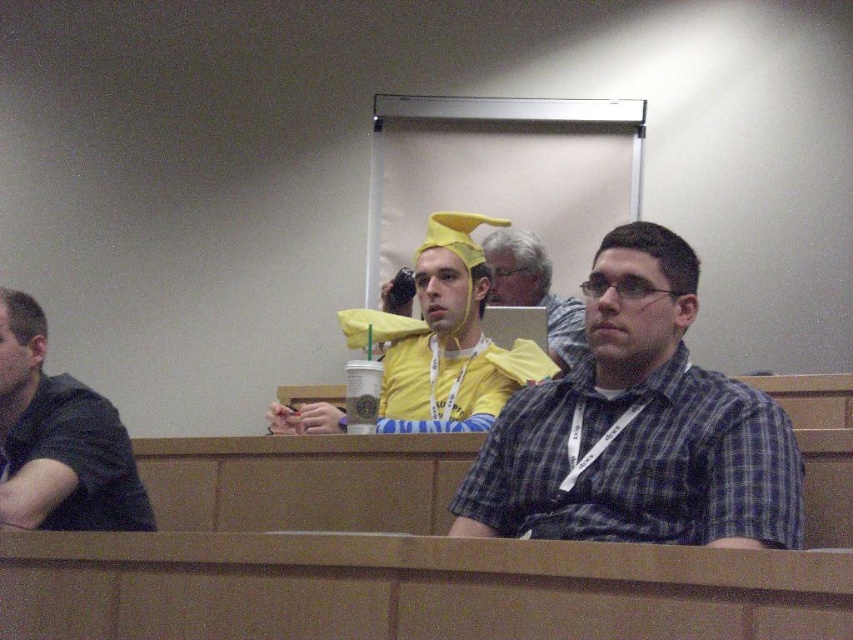
Which is more to the left, plaid shirt at center or yellow matte banana at center?

yellow matte banana at center

Does plaid shirt at center have a lesser height compared to yellow matte banana at center?

Correct, plaid shirt at center is not as tall as yellow matte banana at center.

Which is behind, point (697, 516) or point (474, 316)?

The point (474, 316) is more distant.

Locate an element on the screen. plaid shirt at center is located at coordinates [637, 428].

Does plaid shirt at center appear on the right side of dark gray shirt at left?

Indeed, plaid shirt at center is positioned on the right side of dark gray shirt at left.

I want to click on plaid shirt at center, so click(637, 428).

Is yellow matte banana at center thinner than yellow fabric hat at center?

Incorrect, yellow matte banana at center's width is not less than yellow fabric hat at center's.

Is yellow matte banana at center above yellow fabric hat at center?

No.

Where is `yellow matte banana at center`? This screenshot has width=853, height=640. yellow matte banana at center is located at coordinates (445, 339).